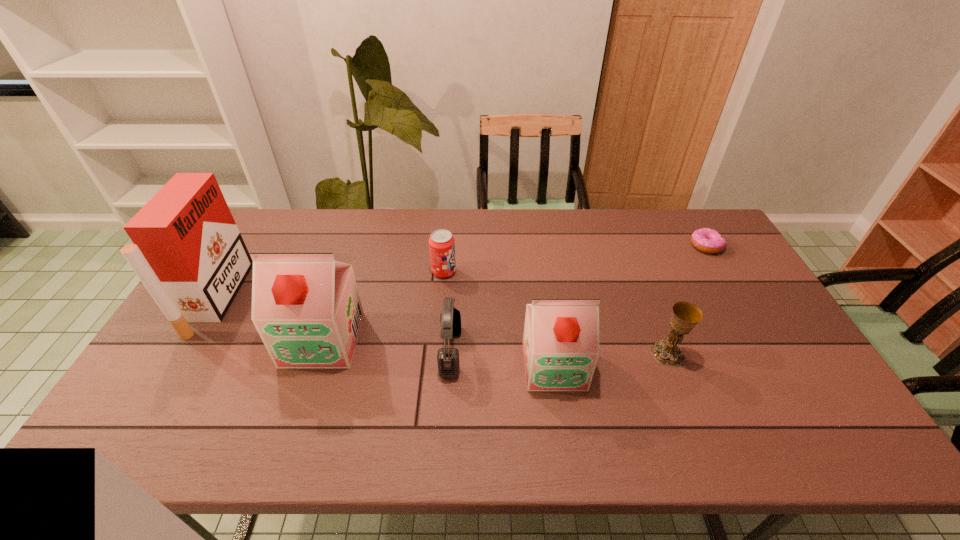
At what (x,y) coordinates should I click in order to perform the action: click on object that is at the right edge. Please return your answer as a coordinate pair (x, y). Looking at the image, I should click on (706, 240).

The image size is (960, 540). Find the location of `object located at the far right corner`. object located at the far right corner is located at coordinates (706, 240).

In the image, there is a desktop. Where is `free region at the far edge`? Image resolution: width=960 pixels, height=540 pixels. free region at the far edge is located at coordinates (480, 249).

Locate an element on the screen. This screenshot has width=960, height=540. vacant space at the near edge of the desktop is located at coordinates coord(273,409).

Identify the location of free region at the left edge of the desktop. (206, 324).

In the image, there is a desktop. In order to click on vacant space at the right edge in this screenshot , I will do `click(756, 366)`.

This screenshot has width=960, height=540. What are the coordinates of `blank space at the far left corner of the desktop` in the screenshot? It's located at (283, 231).

You are a GUI agent. You are given a task and a screenshot of the screen. Output one action in this format:
    pyautogui.click(x=<x>, y=<y>)
    Task: Click on the free space that is in between the headset and the shorter soya milk
    The width and height of the screenshot is (960, 540).
    Given the screenshot: What is the action you would take?
    pyautogui.click(x=502, y=359)

Identify the location of empty space between the leftmost object and the shorter soya milk. (386, 332).

Locate an element on the screen. vacant point located between the rightmost object and the leftmost object is located at coordinates (462, 272).